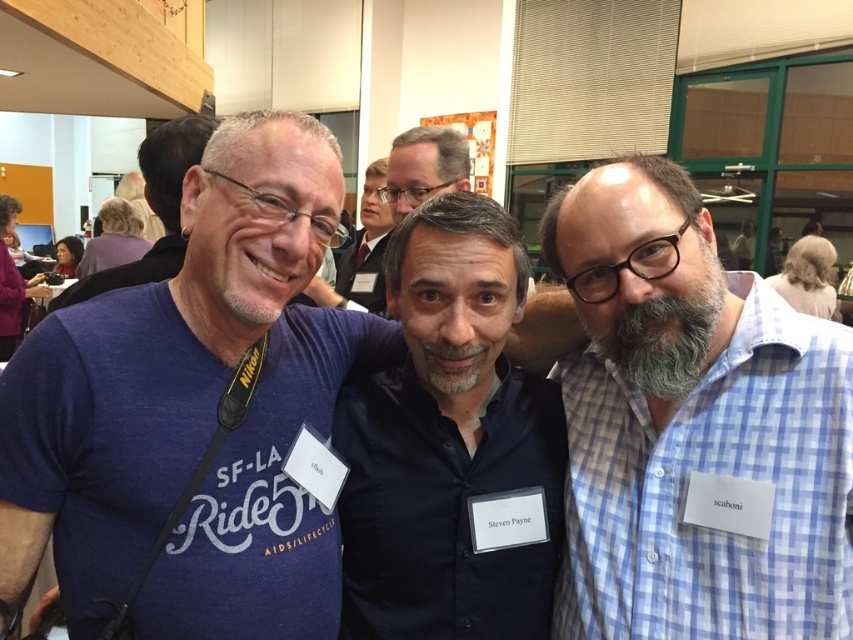
Question: Considering the real-world distances, which object is closest to the blue checkered shirt at right?

Choices:
 (A) matte blue t-shirt at center
 (B) dark blue shirt at center

Answer: (B)

Question: Estimate the real-world distances between objects in this image. Which object is farther from the matte black shirt at center?

Choices:
 (A) matte blue t-shirt at center
 (B) dark blue shirt at center
 (C) blue checkered shirt at right

Answer: (C)

Question: Can you confirm if blue checkered shirt at right is thinner than dark blue shirt at center?

Choices:
 (A) yes
 (B) no

Answer: (B)

Question: From the image, what is the correct spatial relationship of matte blue t-shirt at center in relation to dark blue shirt at center?

Choices:
 (A) below
 (B) above

Answer: (B)

Question: Estimate the real-world distances between objects in this image. Which object is farther from the dark blue shirt at center?

Choices:
 (A) matte blue t-shirt at center
 (B) matte black shirt at center
 (C) blue checkered shirt at right

Answer: (B)

Question: Does matte blue t-shirt at center have a larger size compared to dark blue shirt at center?

Choices:
 (A) yes
 (B) no

Answer: (A)